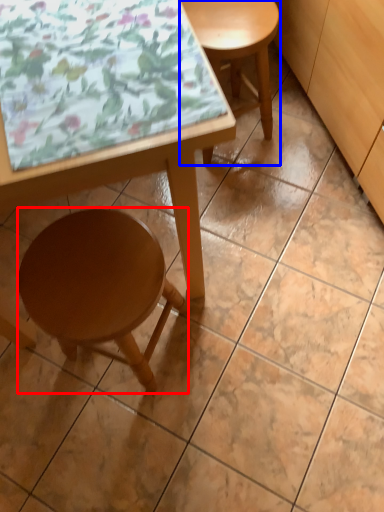
Question: Among these objects, which one is farthest to the camera, stool (highlighted by a red box) or stool (highlighted by a blue box)?

Choices:
 (A) stool
 (B) stool

Answer: (B)